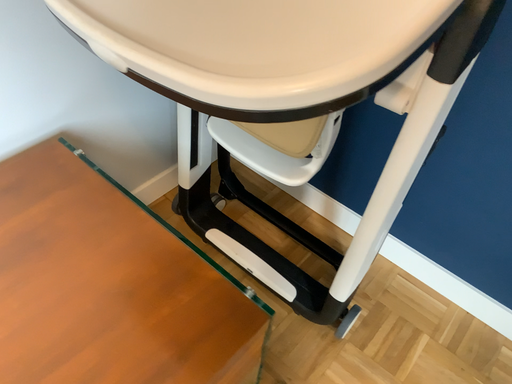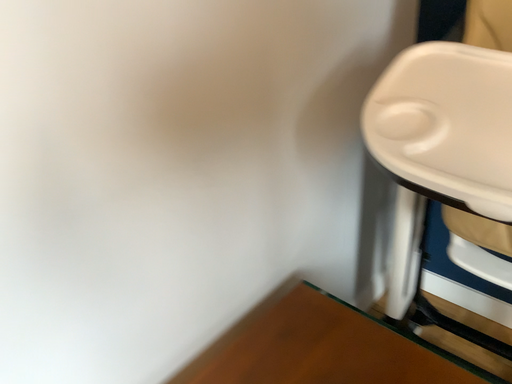
Question: How did the camera likely rotate when shooting the video?

Choices:
 (A) rotated right
 (B) rotated left

Answer: (B)